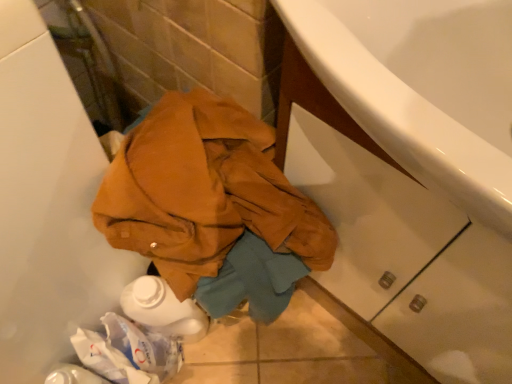
Question: Is leather jacket at center taller or shorter than white glossy cabinet at lower right?

Choices:
 (A) tall
 (B) short

Answer: (B)

Question: Looking at their shapes, would you say leather jacket at center is wider or thinner than white glossy cabinet at lower right?

Choices:
 (A) thin
 (B) wide

Answer: (A)

Question: Would you say leather jacket at center is inside or outside white glossy cabinet at lower right?

Choices:
 (A) inside
 (B) outside

Answer: (B)

Question: In the image, is white glossy cabinet at lower right positioned in front of or behind leather jacket at center?

Choices:
 (A) front
 (B) behind

Answer: (A)

Question: From the image's perspective, is white glossy cabinet at lower right located above or below leather jacket at center?

Choices:
 (A) below
 (B) above

Answer: (B)

Question: Is white glossy cabinet at lower right bigger or smaller than leather jacket at center?

Choices:
 (A) big
 (B) small

Answer: (A)

Question: Looking at their shapes, would you say white glossy cabinet at lower right is wider or thinner than leather jacket at center?

Choices:
 (A) thin
 (B) wide

Answer: (B)